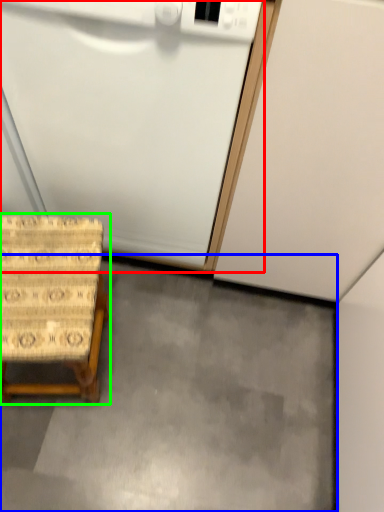
Question: Based on their relative distances, which object is farther from appliance (highlighted by a red box)? Choose from concrete (highlighted by a blue box) and furniture (highlighted by a green box).

Choices:
 (A) concrete
 (B) furniture

Answer: (A)